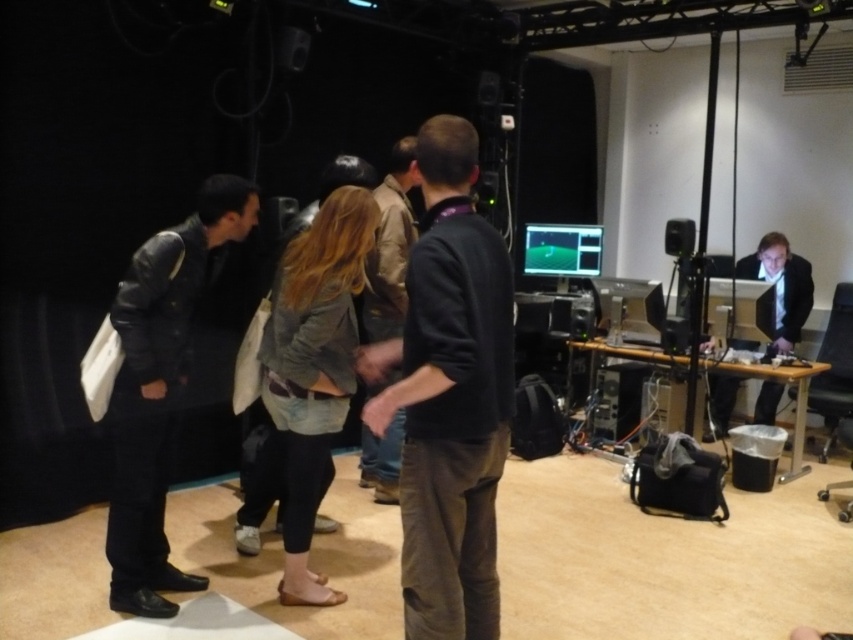
You are standing at the back of the studio and want to take a photo of the leather jacket at left and the matte black suit at right. Which one will appear larger in your photo?

The leather jacket at left will appear larger in the photo because it is closer to the viewer than the matte black suit at right.